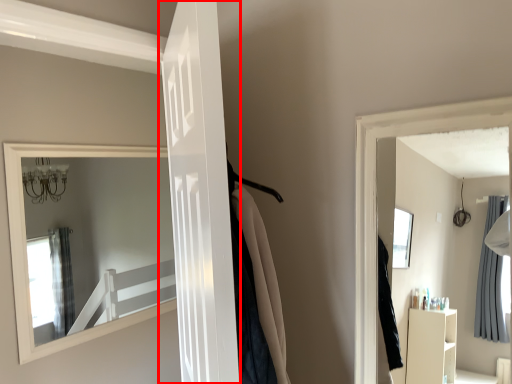
Question: From the image's perspective, what is the correct spatial relationship of door (annotated by the red box) in relation to door?

Choices:
 (A) below
 (B) above

Answer: (A)